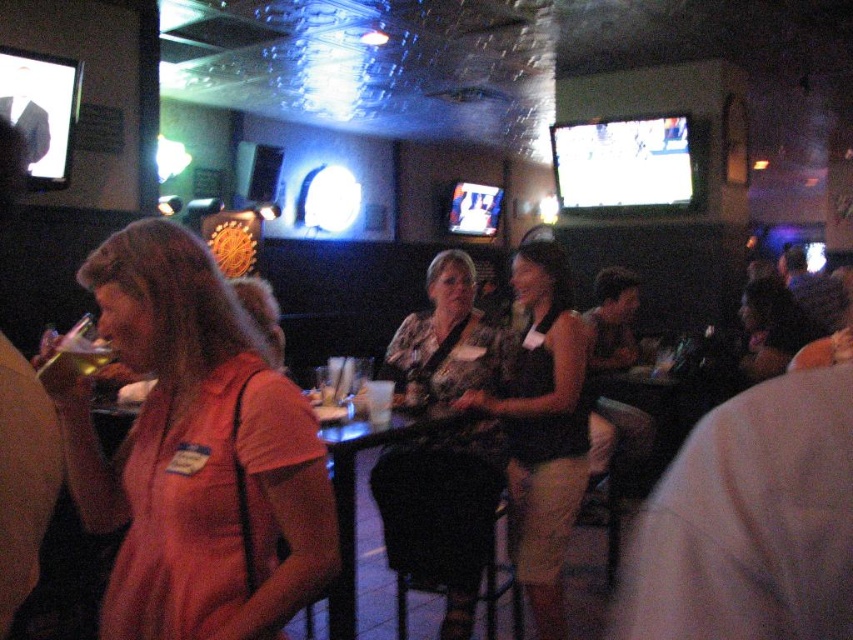
You are a photographer taking a picture of the orange fabric shirt at left and the matte black tank top at center in the bar scene. Which clothing item should you focus on first if you want to capture both in a single shot without moving the camera?

The orange fabric shirt at left has a lesser height compared to matte black tank top at center, so you should focus on the matte black tank top at center first as it is taller and will require more attention in the frame.

You are standing at the origin point of the coordinate system in the bar scene. You want to move toward the point with coordinates (196, 452). What object are you heading towards?

The point (196, 452) is located on the orange fabric shirt at left, so you are heading towards the orange fabric shirt at left.

You are a bartender trying to place a new drink order on the table between the orange fabric shirt at left and the matte black tank top at center. Which side should you place it so that it doesn not block the view of either patron?

The orange fabric shirt at left might be wider than matte black tank top at center, so placing the drink order on the side of the matte black tank top at center would minimize the chance of blocking their view since the orange fabric shirt at left could take up more space.